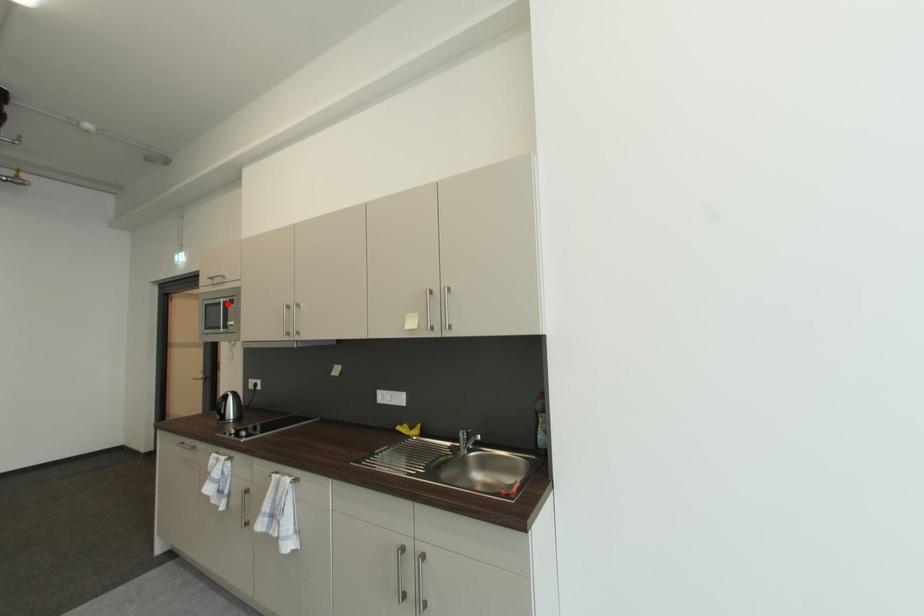
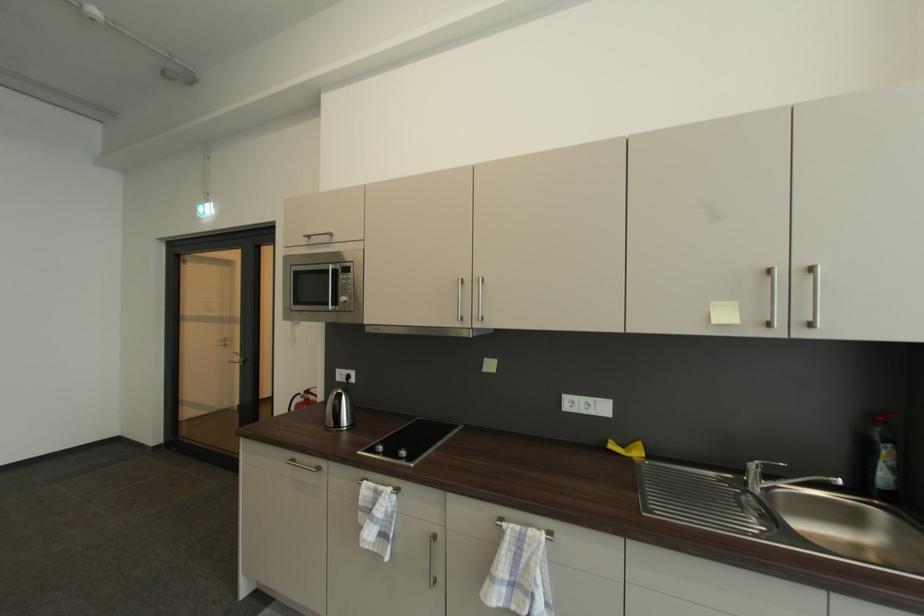
Locate, in the second image, the point that corresponds to the highlighted location in the first image.

(334, 272)